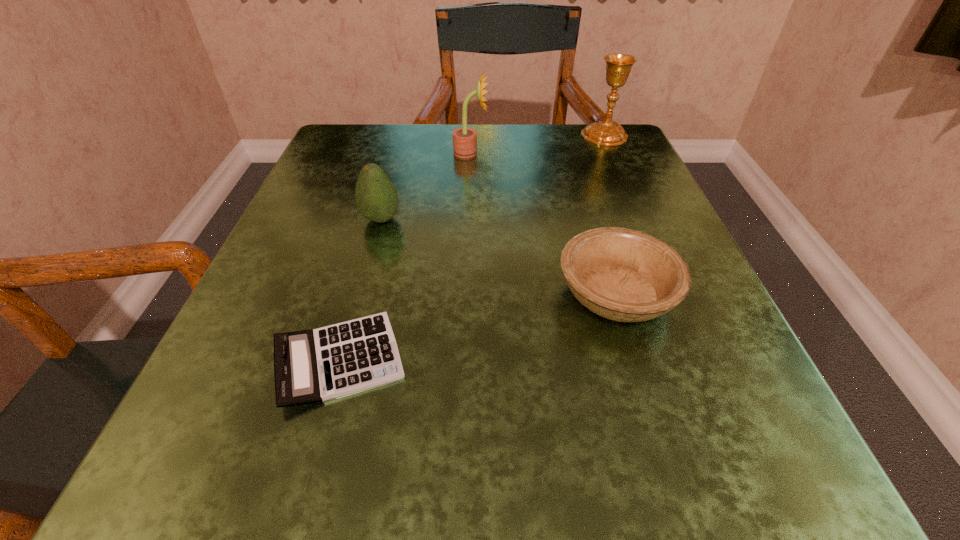
The height and width of the screenshot is (540, 960). I want to click on the third object from left to right, so click(464, 139).

At what (x,y) coordinates should I click in order to perform the action: click on chalice. Please return your answer as a coordinate pair (x, y). Looking at the image, I should click on (618, 66).

You are a GUI agent. You are given a task and a screenshot of the screen. Output one action in this format:
    pyautogui.click(x=<x>, y=<y>)
    Task: Click on the avocado
    The image size is (960, 540).
    Given the screenshot: What is the action you would take?
    pyautogui.click(x=376, y=197)

Find the location of a particular element. Image resolution: width=960 pixels, height=540 pixels. the third nearest object is located at coordinates (376, 197).

At what (x,y) coordinates should I click in order to perform the action: click on bowl. Please return your answer as a coordinate pair (x, y). Looking at the image, I should click on (625, 275).

At what (x,y) coordinates should I click in order to perform the action: click on the shortest object. Please return your answer as a coordinate pair (x, y). Looking at the image, I should click on (310, 366).

The width and height of the screenshot is (960, 540). Find the location of `vacant position located on the face of the third object from right to left`. vacant position located on the face of the third object from right to left is located at coordinates (626, 153).

Where is `vacant region located on the front of the chalice`? vacant region located on the front of the chalice is located at coordinates (617, 163).

Locate an element on the screen. free space located 0.170m on the front of the third nearest object is located at coordinates (357, 307).

Find the location of a particular element. free space located 0.070m on the left of the bowl is located at coordinates (507, 294).